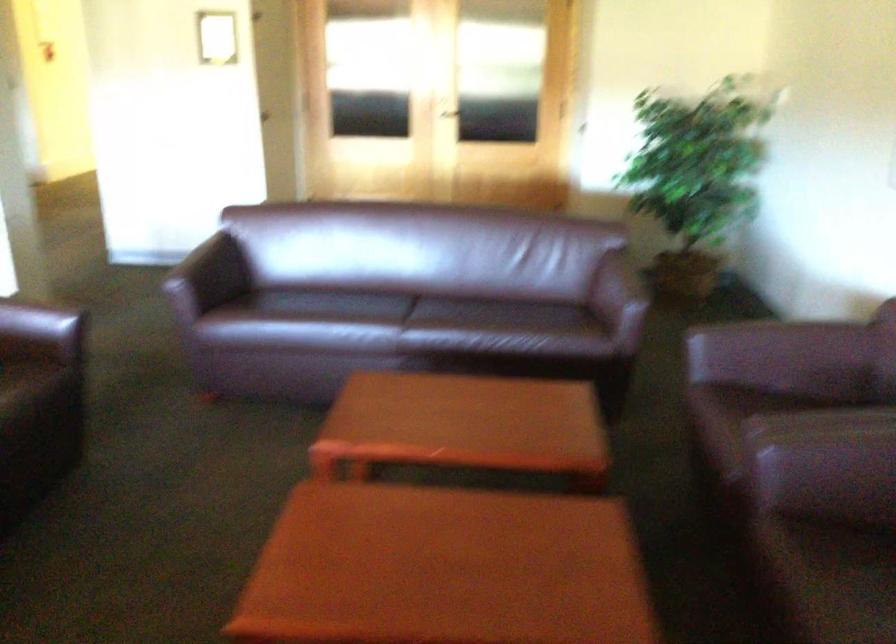
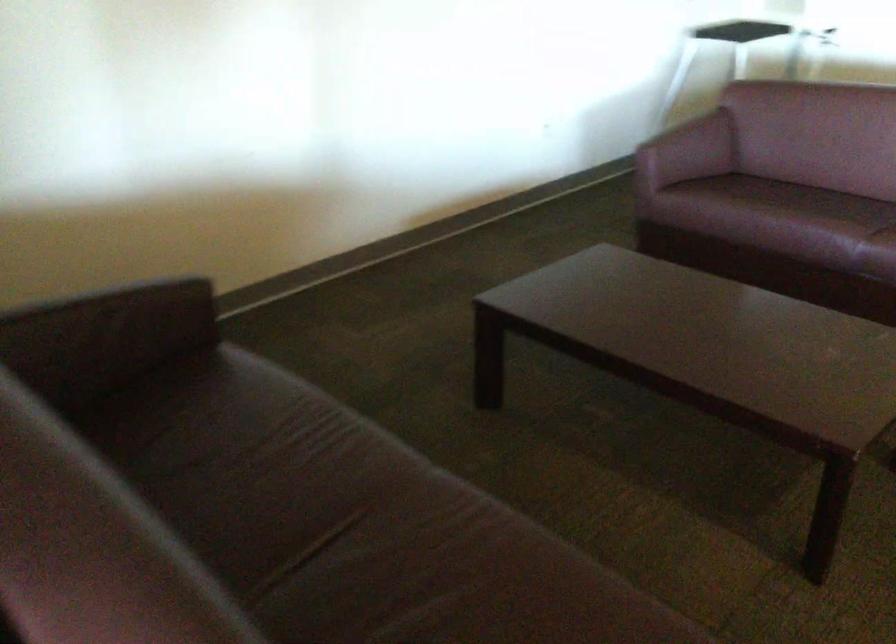
In the scene shown: The images are taken continuously from a first-person perspective. In which direction is your viewpoint rotating?

The camera's rotation is toward right-down.